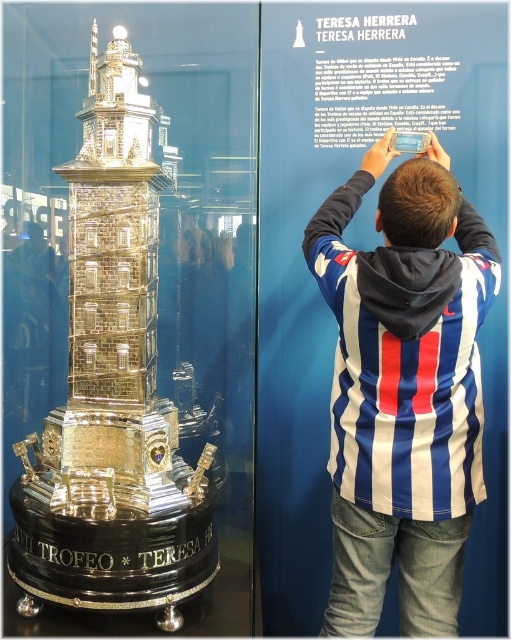
Which of these two, blue striped hoodie at upper center or gold plated tower at center, stands taller?

Standing taller between the two is gold plated tower at center.

Is blue striped hoodie at upper center above gold plated tower at center?

No.

Is point (475, 499) in front of point (64, 516)?

No, (475, 499) is further to viewer.

You are a GUI agent. You are given a task and a screenshot of the screen. Output one action in this format:
    pyautogui.click(x=<x>, y=<y>)
    Task: Click on the blue striped hoodie at upper center
    The image size is (511, 640).
    Given the screenshot: What is the action you would take?
    pyautogui.click(x=404, y=390)